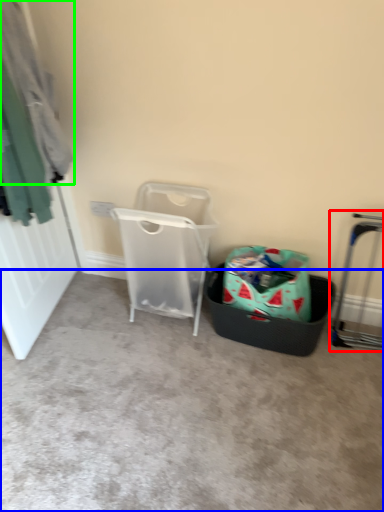
Question: Estimate the real-world distances between objects in this image. Which object is farther from trolley (highlighted by a red box), concrete (highlighted by a blue box) or clothing (highlighted by a green box)?

Choices:
 (A) concrete
 (B) clothing

Answer: (B)